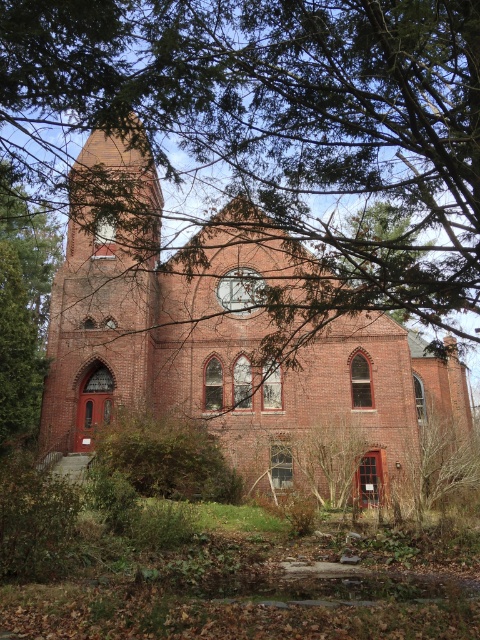
You are standing in a park and see the green leafy tree at center and the brick church at center. Which one appears bigger in size?

The brick church at center appears bigger in size compared to the green leafy tree at center.

You are standing in front of the brick church at center and want to take a photo of it. There is a green leafy tree at center in front of the building. Do you think the tree will block the view of the top of the church?

The green leafy tree at center has a lesser height compared to brick church at center, so the tree is shorter than the church. Therefore, the top of the brick church at center will still be visible above the tree.